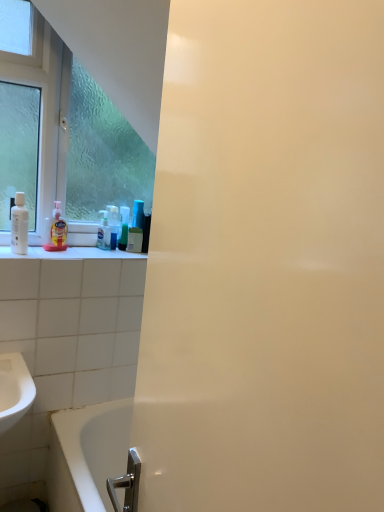
Question: Considering the positions of white glossy bathtub at lower left and translucent plastic soap dispenser at left, which ranks as the first cleaning product in left-to-right order, in the image, is white glossy bathtub at lower left taller or shorter than translucent plastic soap dispenser at left, which ranks as the first cleaning product in left-to-right order,?

Choices:
 (A) tall
 (B) short

Answer: (A)

Question: Does point (104, 410) appear closer or farther from the camera than point (57, 206)?

Choices:
 (A) closer
 (B) farther

Answer: (B)

Question: Considering the real-world distances, which object is closest to the white glossy bathtub at lower left?

Choices:
 (A) translucent plastic soap dispenser at left, placed as the 2th cleaning product when sorted from right to left
 (B) translucent plastic mouthwash at center, the second mouthwash in the left-to-right sequence
 (C) white glossy bottle at left, the second mouthwash from the right
 (D) translucent plastic bottle at center, which is the second cleaning product in front-to-back order
 (E) clear glass window at upper left

Answer: (A)

Question: Estimate the real-world distances between objects in this image. Which object is closer to the clear glass window at upper left?

Choices:
 (A) white glossy bathtub at lower left
 (B) translucent plastic soap dispenser at left, placed as the 2th cleaning product when sorted from right to left
 (C) translucent plastic mouthwash at center, the 2th mouthwash in the front-to-back sequence
 (D) white glossy bottle at left, which is the 2th mouthwash from back to front
 (E) translucent plastic bottle at center, marked as the 2th cleaning product in a left-to-right arrangement

Answer: (B)